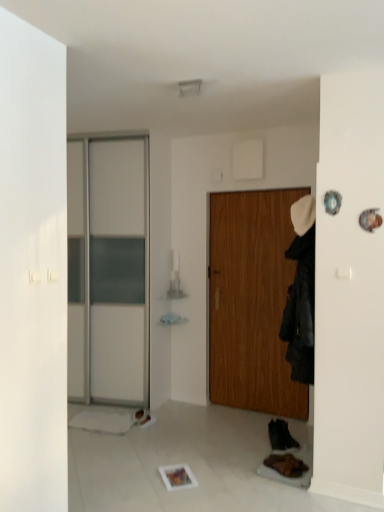
This screenshot has width=384, height=512. What are the coordinates of `blank space situated above wooden door at center (from a real-world perspective)` in the screenshot? It's located at (258, 188).